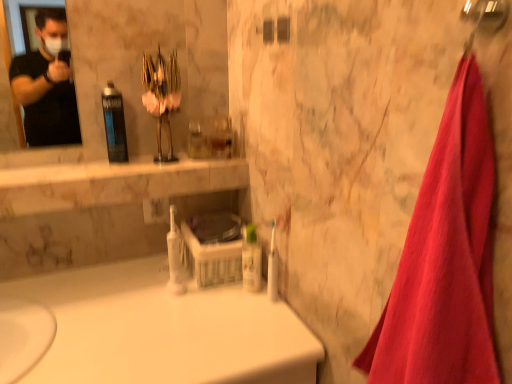
Question: Considering the relative positions of translucent plastic mouthwash at center, the first mouthwash when ordered from top to bottom, and white glossy bathtub at center in the image provided, is translucent plastic mouthwash at center, the first mouthwash when ordered from top to bottom, to the left of white glossy bathtub at center from the viewer's perspective?

Choices:
 (A) no
 (B) yes

Answer: (B)

Question: Can you confirm if translucent plastic mouthwash at center, the first mouthwash when ordered from top to bottom, is thinner than white glossy bathtub at center?

Choices:
 (A) yes
 (B) no

Answer: (A)

Question: Can you confirm if translucent plastic mouthwash at center, the first mouthwash when ordered from top to bottom, is taller than white glossy bathtub at center?

Choices:
 (A) yes
 (B) no

Answer: (B)

Question: From the image's perspective, does translucent plastic mouthwash at center, the first mouthwash when ordered from top to bottom, appear lower than white glossy bathtub at center?

Choices:
 (A) yes
 (B) no

Answer: (B)

Question: Is translucent plastic mouthwash at center, which is the third mouthwash in bottom-to-top order, aimed at white glossy bathtub at center?

Choices:
 (A) yes
 (B) no

Answer: (B)

Question: Looking at their shapes, would you say white plastic toothbrush at center, the second mouthwash positioned from the left, is wider or thinner than translucent plastic mouthwash at center, which is the 3th mouthwash in right-to-left order?

Choices:
 (A) wide
 (B) thin

Answer: (A)

Question: From a real-world perspective, relative to translucent plastic mouthwash at center, the first mouthwash when ordered from top to bottom, is white plastic toothbrush at center, positioned as the 2th mouthwash in right-to-left order, vertically above or below?

Choices:
 (A) above
 (B) below

Answer: (B)

Question: From the image's perspective, is white plastic toothbrush at center, which ranks as the second mouthwash in bottom-to-top order, positioned above or below translucent plastic mouthwash at center, which is the 3th mouthwash in right-to-left order?

Choices:
 (A) below
 (B) above

Answer: (A)

Question: Does point (174, 256) appear closer or farther from the camera than point (113, 109)?

Choices:
 (A) farther
 (B) closer

Answer: (B)

Question: Is translucent plastic mouthwash at center, the first mouthwash when ordered from top to bottom, to the left or to the right of clear plastic bottle at center, positioned as the 3th mouthwash in left-to-right order, in the image?

Choices:
 (A) right
 (B) left

Answer: (B)

Question: Is translucent plastic mouthwash at center, the first mouthwash when ordered from top to bottom, taller or shorter than clear plastic bottle at center, placed as the 1th mouthwash when sorted from bottom to top?

Choices:
 (A) short
 (B) tall

Answer: (B)

Question: Considering the positions of point tap(102, 112) and point tap(247, 263), is point tap(102, 112) closer or farther from the camera than point tap(247, 263)?

Choices:
 (A) farther
 (B) closer

Answer: (A)

Question: From the image's perspective, is translucent plastic mouthwash at center, which is the third mouthwash in bottom-to-top order, positioned above or below clear plastic bottle at center, placed as the 1th mouthwash when sorted from bottom to top?

Choices:
 (A) above
 (B) below

Answer: (A)

Question: Is white plastic toothbrush at center taller or shorter than translucent plastic mouthwash at center, which is the 3th mouthwash in right-to-left order?

Choices:
 (A) short
 (B) tall

Answer: (A)

Question: In terms of width, does white plastic toothbrush at center look wider or thinner when compared to translucent plastic mouthwash at center, which is the third mouthwash in bottom-to-top order?

Choices:
 (A) thin
 (B) wide

Answer: (A)